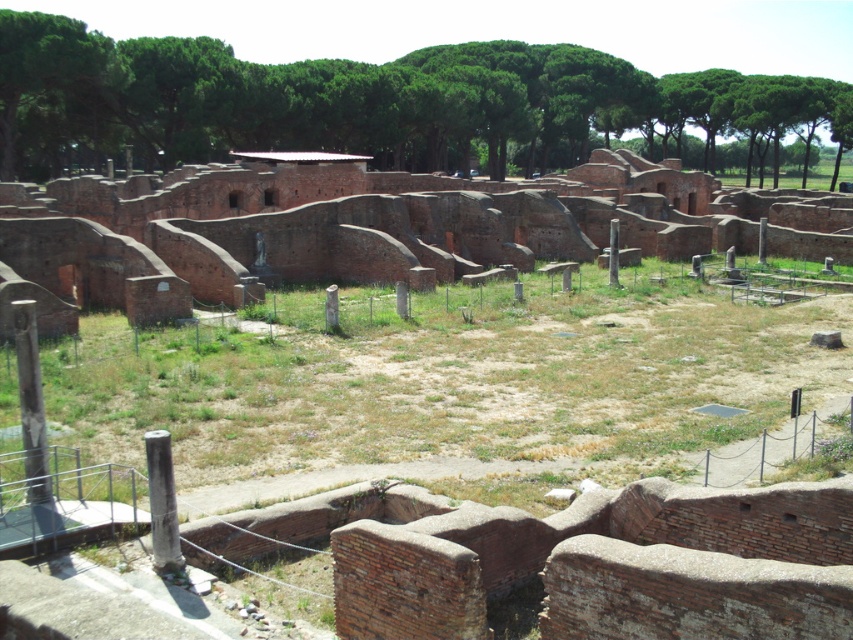
You are a tour guide leading a group around the archaeological site. You need to explain the differences between the smooth stone pillar at lower left and the gray stone pillar at lower left. Based on the pillars in the image, which one is wider?

The smooth stone pillar at lower left is wider than the gray stone pillar at lower left.

You are a tour guide at the archaeological site. You need to inform visitors about the size comparison between the brick wall at center and the gray stone pillar at lower left. What do you tell them?

The brick wall at center is bigger than the gray stone pillar at lower left.

You are a tour guide leading visitors around the archaeological site. You notice two pillars, the smooth stone pillar at lower left and the gray stone pillar at lower left. Which pillar should visitors approach first if they want to follow the path that goes from left to right across the site?

The smooth stone pillar at lower left is to the left of the gray stone pillar at lower left, so visitors should approach the smooth stone pillar at lower left first as it is positioned further to the left along the path.